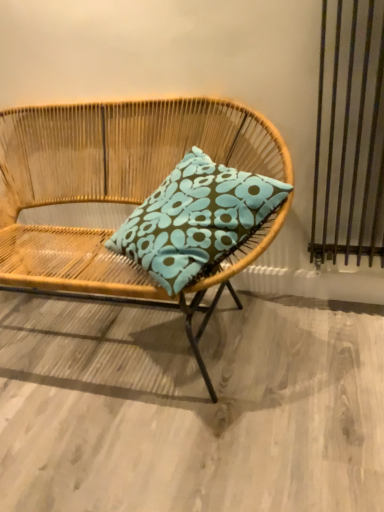
Question: Should I look upward or downward to see woven wood chair at center?

Choices:
 (A) up
 (B) down

Answer: (A)

Question: Is teal fabric pillow at center at the right side of woven wood chair at center?

Choices:
 (A) no
 (B) yes

Answer: (B)

Question: From a real-world perspective, is teal fabric pillow at center over woven wood chair at center?

Choices:
 (A) yes
 (B) no

Answer: (A)

Question: Is woven wood chair at center completely or partially inside teal fabric pillow at center?

Choices:
 (A) no
 (B) yes

Answer: (A)

Question: Is the position of teal fabric pillow at center more distant than that of woven wood chair at center?

Choices:
 (A) no
 (B) yes

Answer: (B)

Question: Can you confirm if teal fabric pillow at center is wider than woven wood chair at center?

Choices:
 (A) yes
 (B) no

Answer: (B)

Question: Is teal fabric pillow at center looking in the opposite direction of woven wood chair at center?

Choices:
 (A) yes
 (B) no

Answer: (A)

Question: Can you see woven wood chair at center touching teal fabric pillow at center?

Choices:
 (A) no
 (B) yes

Answer: (A)

Question: From the image's perspective, is woven wood chair at center above teal fabric pillow at center?

Choices:
 (A) no
 (B) yes

Answer: (A)

Question: Is woven wood chair at center further to camera compared to teal fabric pillow at center?

Choices:
 (A) yes
 (B) no

Answer: (B)

Question: Does woven wood chair at center turn towards teal fabric pillow at center?

Choices:
 (A) yes
 (B) no

Answer: (A)

Question: Can you confirm if woven wood chair at center is bigger than teal fabric pillow at center?

Choices:
 (A) no
 (B) yes

Answer: (B)

Question: Is woven wood chair at center outside of teal fabric pillow at center?

Choices:
 (A) no
 (B) yes

Answer: (B)

Question: Is woven wood chair at center taller or shorter than teal fabric pillow at center?

Choices:
 (A) tall
 (B) short

Answer: (A)